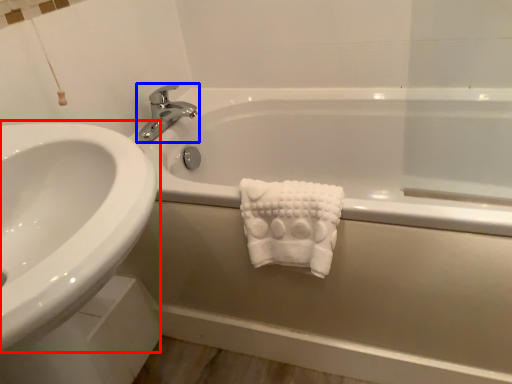
Question: Which point is closer to the camera, sink (highlighted by a red box) or tap (highlighted by a blue box)?

Choices:
 (A) sink
 (B) tap

Answer: (A)